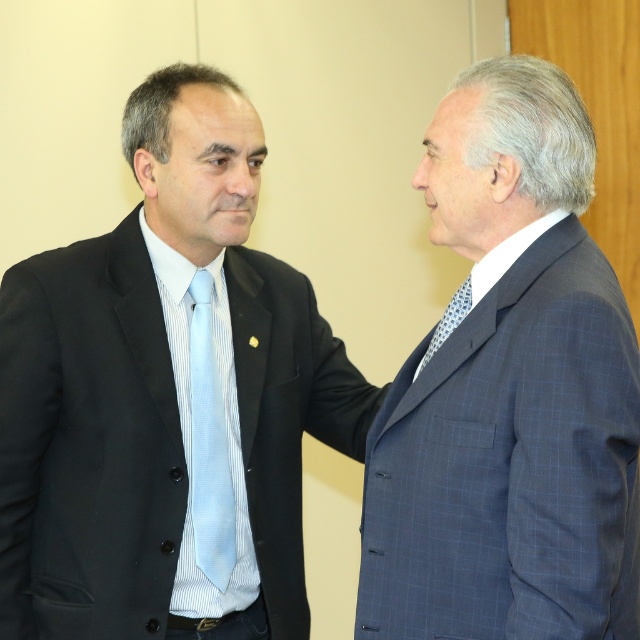
Consider the image. Can you confirm if blue checkered suit at right is bigger than blue dotted tie at right?

Correct, blue checkered suit at right is larger in size than blue dotted tie at right.

Is blue checkered suit at right taller than blue dotted tie at right?

Yes, blue checkered suit at right is taller than blue dotted tie at right.

Does point (384, 550) lie behind point (458, 323)?

No, it is not.

At what (x,y) coordinates should I click in order to perform the action: click on blue checkered suit at right. Please return your answer as a coordinate pair (x, y). The height and width of the screenshot is (640, 640). Looking at the image, I should click on (509, 394).

From the picture: Which is more to the left, blue checkered suit at right or light blue silk tie at left?

Positioned to the left is light blue silk tie at left.

Can you confirm if blue checkered suit at right is taller than light blue silk tie at left?

Yes, blue checkered suit at right is taller than light blue silk tie at left.

At what (x,y) coordinates should I click in order to perform the action: click on blue checkered suit at right. Please return your answer as a coordinate pair (x, y). Looking at the image, I should click on (509, 394).

Is point (324, 401) positioned before point (592, 296)?

No.

Does matte black suit at left have a lesser width compared to blue checkered suit at right?

No, matte black suit at left is not thinner than blue checkered suit at right.

What do you see at coordinates (166, 397) in the screenshot? I see `matte black suit at left` at bounding box center [166, 397].

Where is `matte black suit at left`? matte black suit at left is located at coordinates (166, 397).